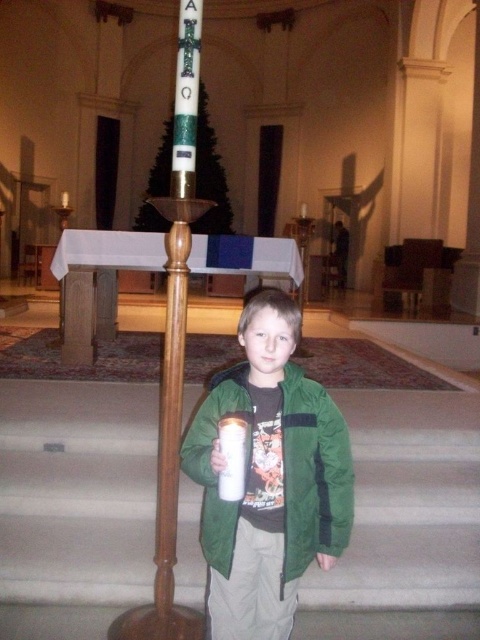
Question: Which point appears closest to the camera in this image?

Choices:
 (A) (430, 572)
 (B) (244, 508)
 (C) (169, 257)

Answer: (B)

Question: Is green matte jacket at center above wooden pole at center?

Choices:
 (A) no
 (B) yes

Answer: (A)

Question: Which of these objects is positioned closest to the wooden pole at center?

Choices:
 (A) smooth beige stairs at center
 (B) white frosted glass at center
 (C) green matte jacket at center

Answer: (C)

Question: Is wooden pole at center below white frosted glass at center?

Choices:
 (A) no
 (B) yes

Answer: (B)

Question: Based on their relative distances, which object is farther from the white frosted glass at center?

Choices:
 (A) green matte jacket at center
 (B) smooth beige stairs at center

Answer: (B)

Question: Can you confirm if smooth beige stairs at center is positioned below green matte jacket at center?

Choices:
 (A) yes
 (B) no

Answer: (A)